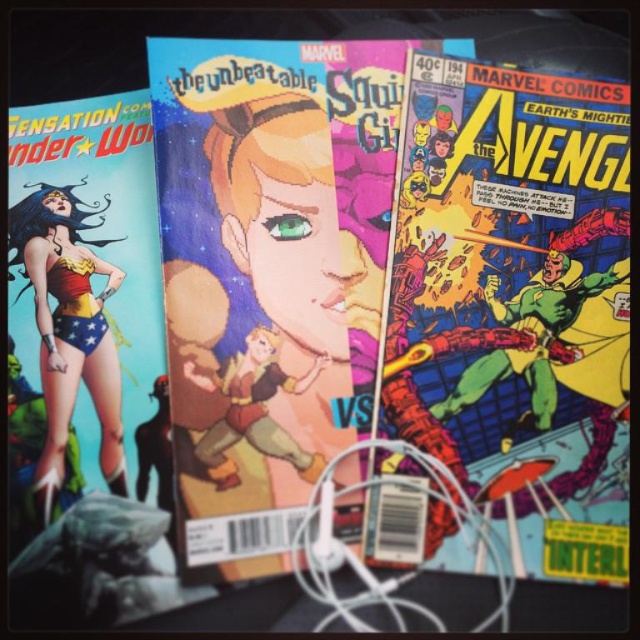
Does multicolored comic book at center have a smaller size compared to shiny red and gold costume at left?

Actually, multicolored comic book at center might be larger than shiny red and gold costume at left.

Is multicolored comic book at center shorter than shiny red and gold costume at left?

In fact, multicolored comic book at center may be taller than shiny red and gold costume at left.

Between point (588, 376) and point (65, 419), which one is positioned behind?

Point (588, 376)

Where is `multicolored comic book at center`? The width and height of the screenshot is (640, 640). multicolored comic book at center is located at coordinates (516, 304).